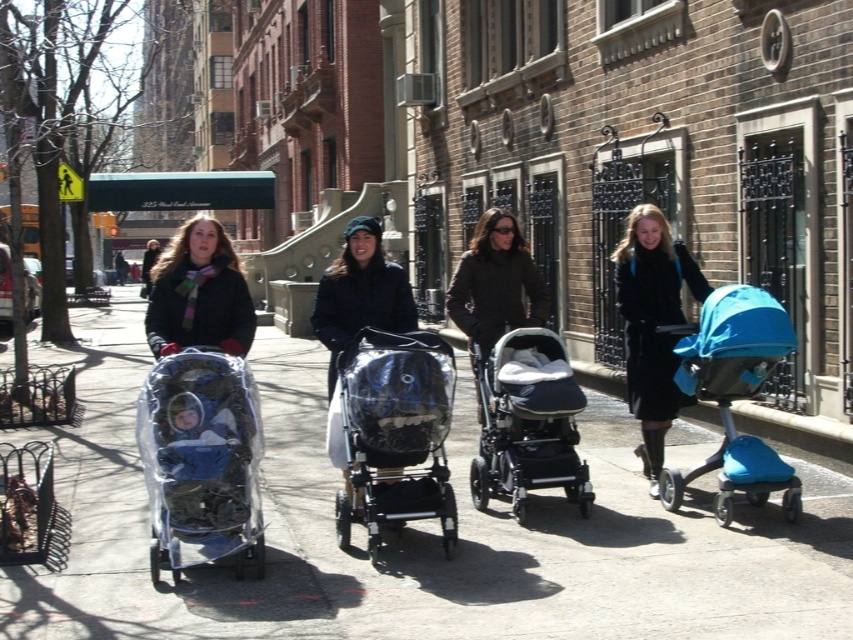
You are standing on the sidewalk and see the teal fabric stroller at right. There is a point at coordinates (x=733, y=394). Is this point located on the teal fabric stroller at right?

Yes, the point at coordinates (x=733, y=394) is located on the teal fabric stroller at right.

You are a pedestrian trying to cross the street and need to quickly assess the space between the transparent plastic stroller at center and the matte black stroller at right. Which stroller is on the left side when looking at them from the sidewalk?

The transparent plastic stroller at center is positioned on the left side of matte black stroller at right.

You are a delivery person trying to navigate a narrow sidewalk. You see the clear concrete sidewalk at center and the matte black stroller at center. Which object is positioned to the left from your perspective?

The clear concrete sidewalk at center is to the left of the matte black stroller at center.